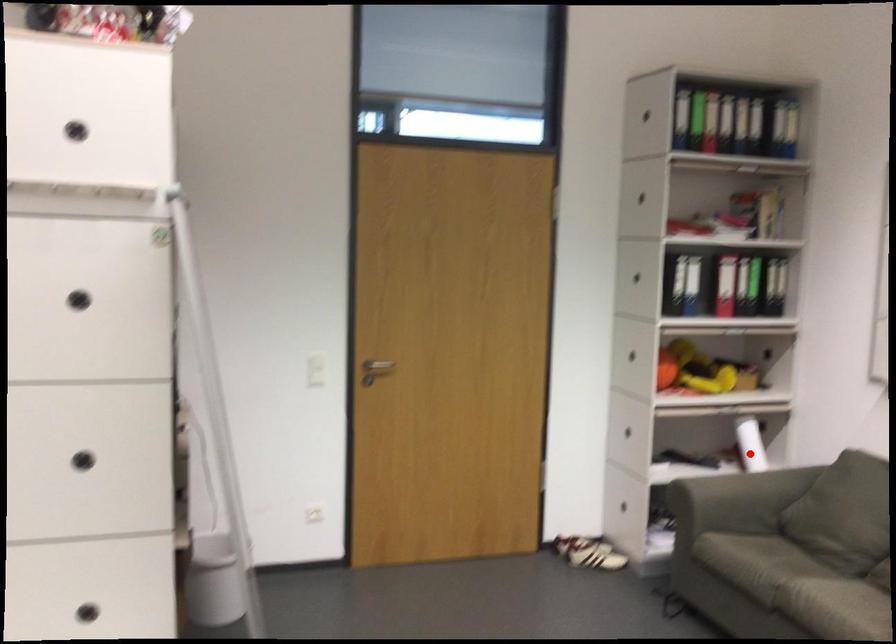
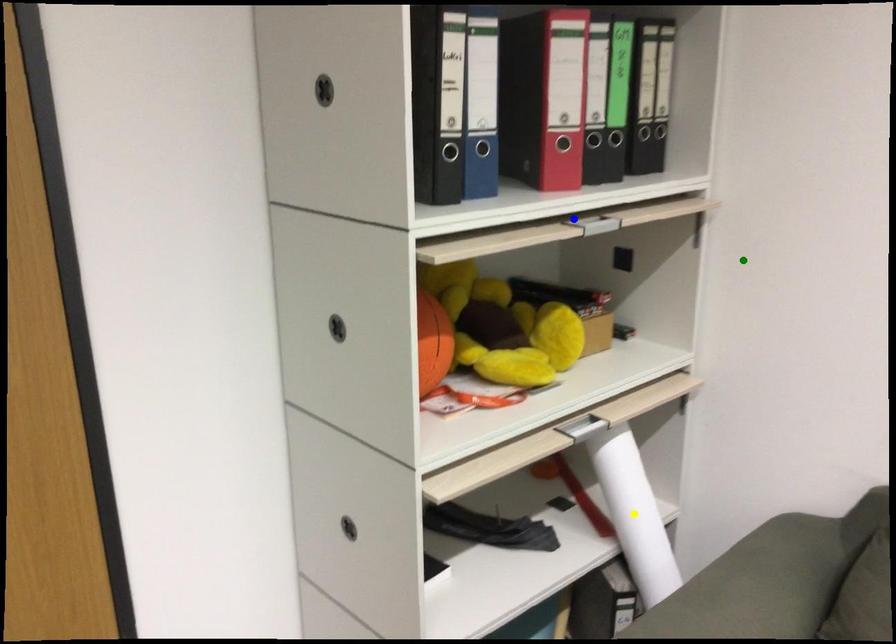
Question: I am providing you with two images of the same scene from different viewpoints. A red point is marked on the first image. You are given multiple points on the second image. Which point in image 2 is actually the same real-world point as the red point in image 1?

Choices:
 (A) green point
 (B) blue point
 (C) yellow point

Answer: (C)